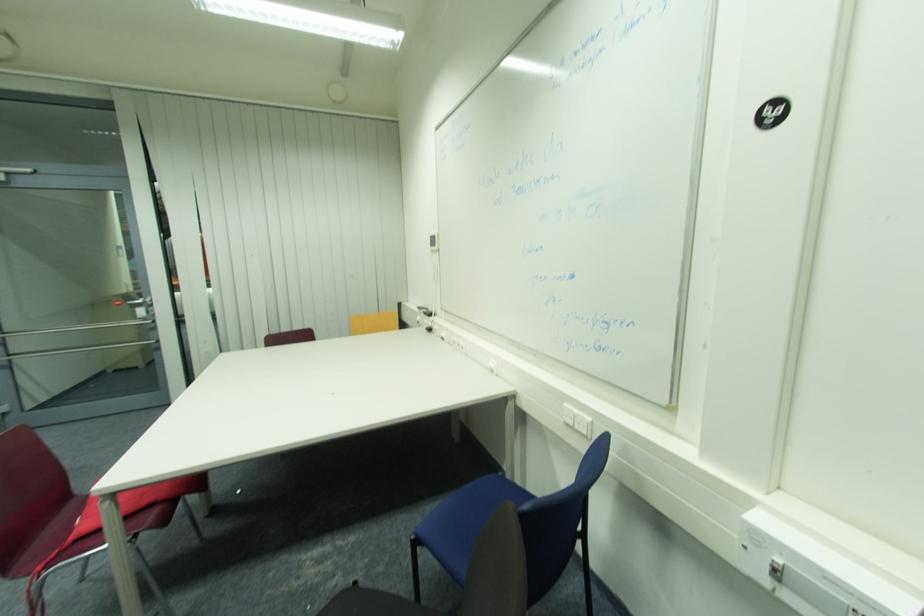
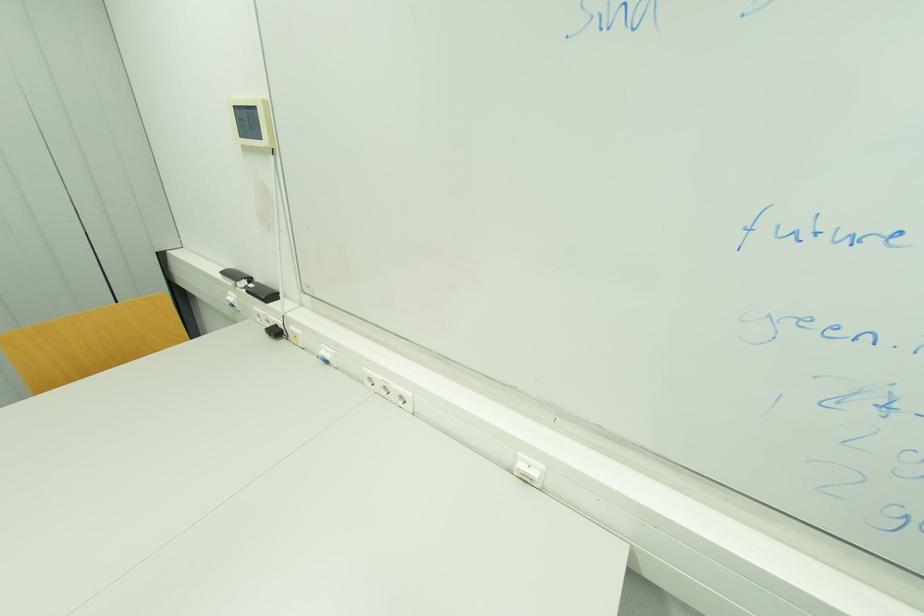
Find the pixel in the second image that matches point (433, 238) in the first image.

(237, 108)